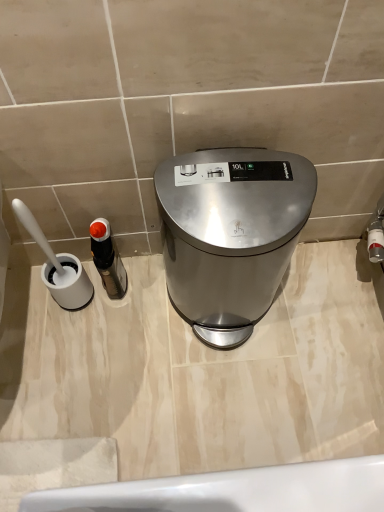
Locate an element on the screen. free point above satin silver trash can at center (from a real-world perspective) is located at coordinates (234, 185).